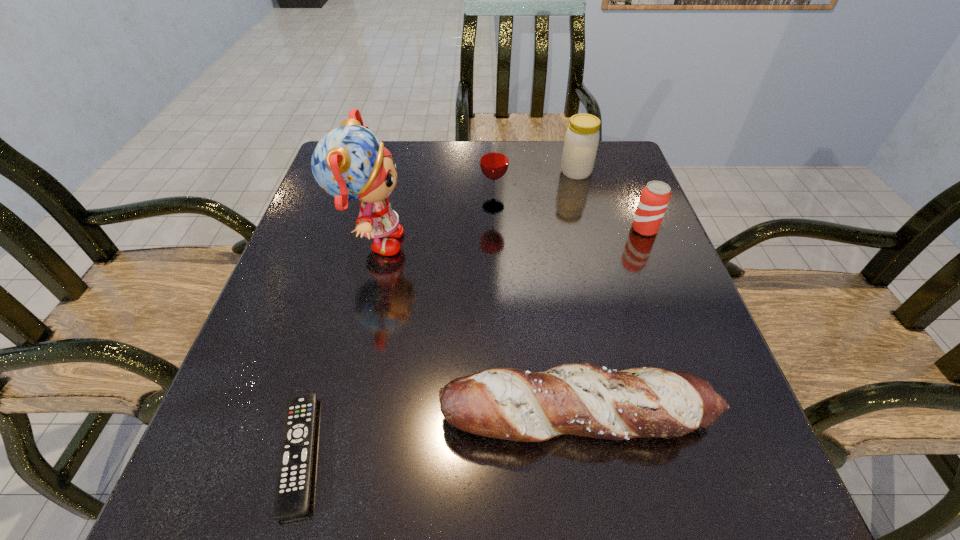
The image size is (960, 540). Find the location of `object present at the far right corner`. object present at the far right corner is located at coordinates click(x=581, y=142).

In order to click on free spot at the far edge of the desktop in this screenshot , I will do `click(540, 180)`.

Where is `vacant space at the near edge of the desktop`? This screenshot has width=960, height=540. vacant space at the near edge of the desktop is located at coordinates point(658,514).

Find the location of a particular element. The height and width of the screenshot is (540, 960). vacant space at the left edge of the desktop is located at coordinates (330, 227).

Find the location of a particular element. The image size is (960, 540). blank area at the right edge is located at coordinates click(618, 258).

The width and height of the screenshot is (960, 540). What are the coordinates of `unoccupied position between the third shortest object and the baguet` in the screenshot? It's located at (612, 322).

Find the location of `vacant point located between the farthest object and the glass`. vacant point located between the farthest object and the glass is located at coordinates (535, 190).

The image size is (960, 540). I want to click on vacant region between the remote control and the beer can, so click(472, 341).

Locate an element on the screen. vacant area between the farthest object and the doll is located at coordinates (474, 208).

I want to click on free point between the tallest object and the glass, so click(x=433, y=225).